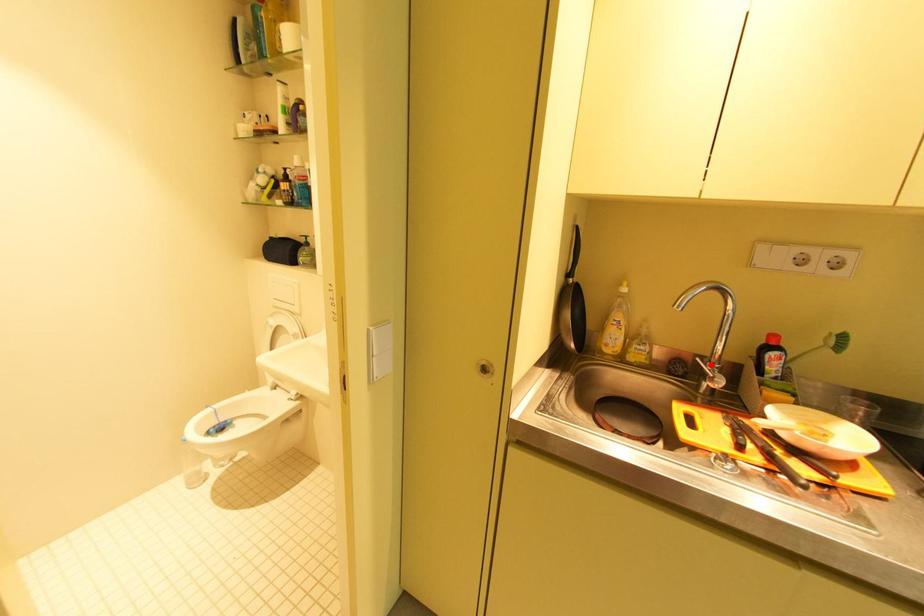
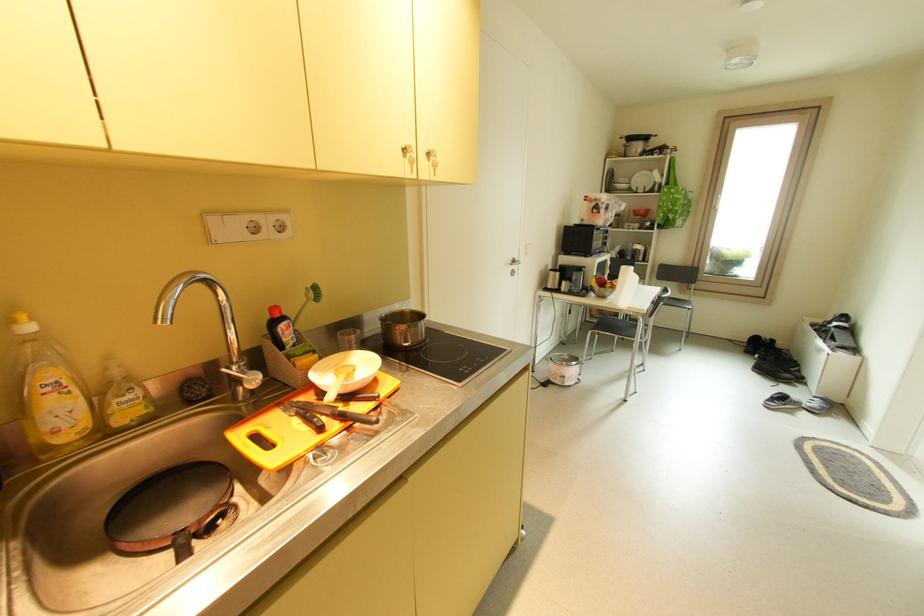
Locate, in the second image, the point that corresponds to the highlighted location in the first image.

(237, 370)